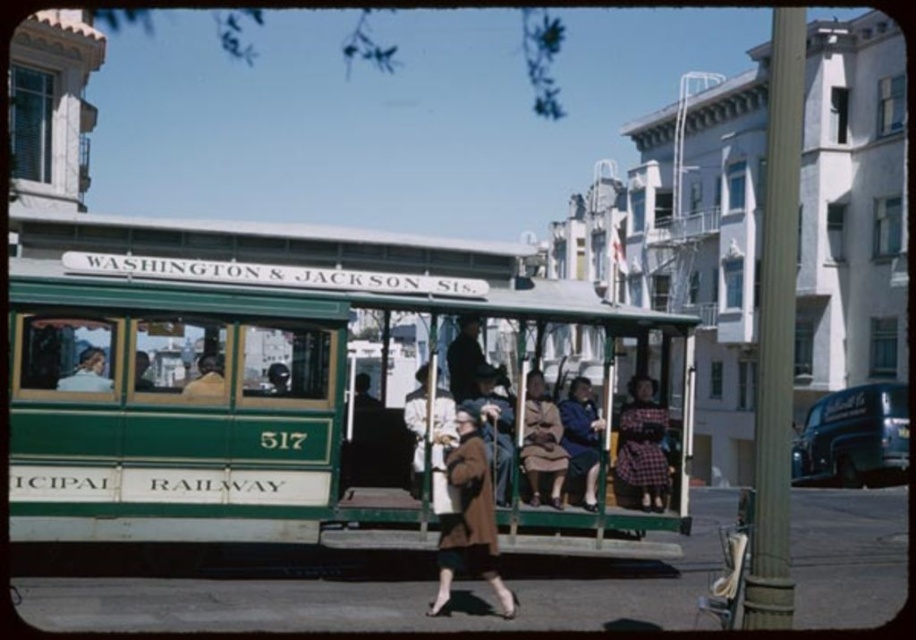
Question: Which of the following is the closest to the observer?

Choices:
 (A) brown fabric coat at center
 (B) shiny dark blue van at right
 (C) brown wool coat at center

Answer: (C)

Question: Does shiny dark blue van at right have a smaller size compared to plaid fabric dress at center?

Choices:
 (A) yes
 (B) no

Answer: (B)

Question: Among these objects, which one is farthest from the camera?

Choices:
 (A) shiny dark blue van at right
 (B) plaid fabric dress at center
 (C) green polished wood cable car at center

Answer: (A)

Question: Can you confirm if green polished wood cable car at center is smaller than brown fabric coat at center?

Choices:
 (A) yes
 (B) no

Answer: (B)

Question: Which point appears closest to the camera in this image?

Choices:
 (A) (165, 497)
 (B) (470, 572)
 (C) (840, 436)
 (D) (640, 493)

Answer: (A)

Question: Does green polished wood cable car at center have a larger size compared to plaid fabric dress at center?

Choices:
 (A) yes
 (B) no

Answer: (A)